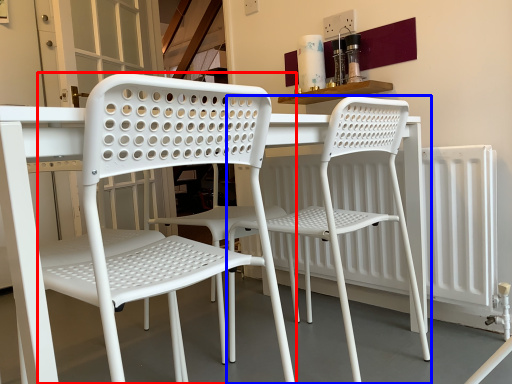
Question: Which object is closer to the camera taking this photo, chair (highlighted by a red box) or chair (highlighted by a blue box)?

Choices:
 (A) chair
 (B) chair

Answer: (A)